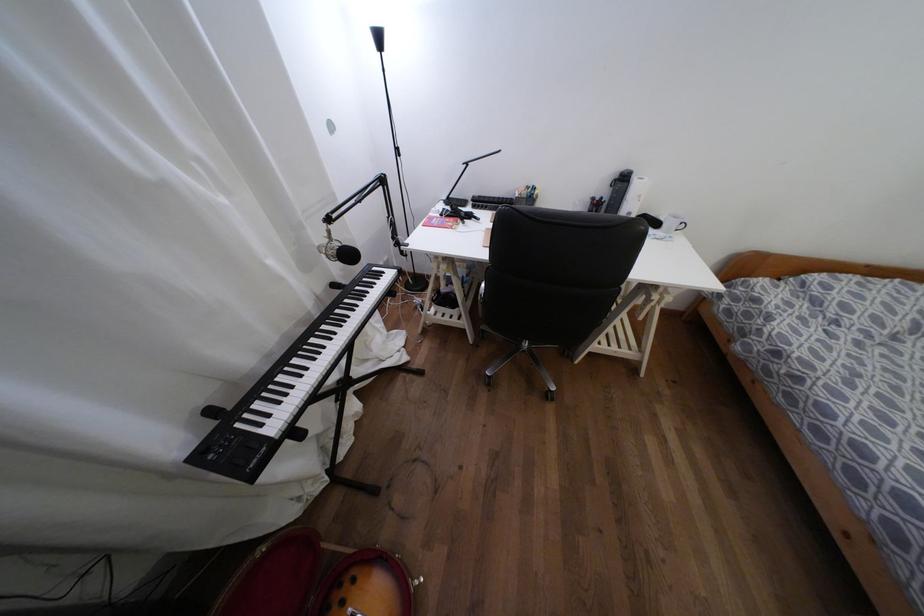
Describe the element at coordinates (381, 182) in the screenshot. I see `a mic arm knob` at that location.